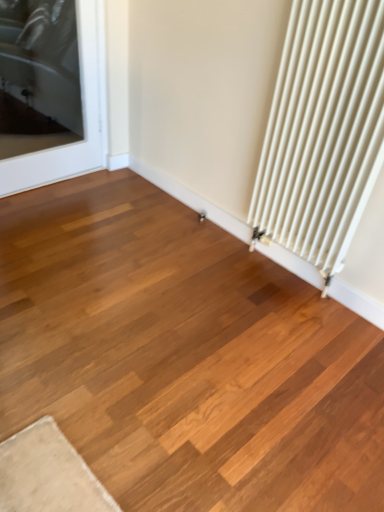
Image resolution: width=384 pixels, height=512 pixels. In order to click on free point to the right of transparent glass door at upper left in this screenshot , I will do `click(100, 187)`.